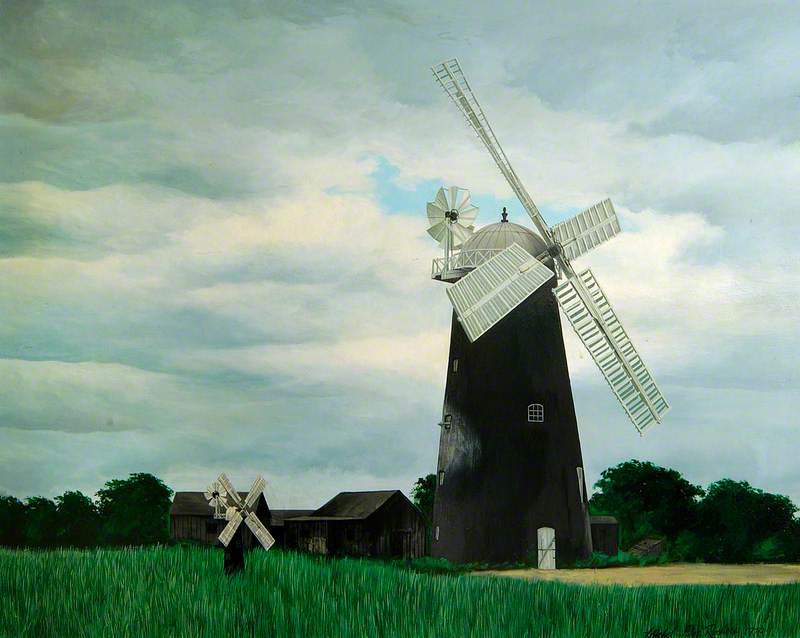
This screenshot has height=638, width=800. I want to click on doorways, so click(x=542, y=547), click(x=400, y=537).